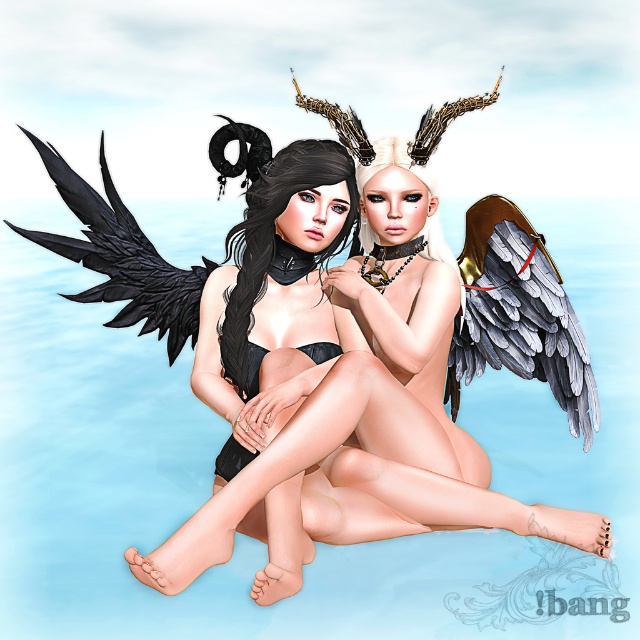
Does point (390, 436) come farther from viewer compared to point (516, 285)?

No, it is not.

At what (x,y) coordinates should I click in order to perform the action: click on black matte wings at upper left. Please return your answer as a coordinate pair (x, y). The width and height of the screenshot is (640, 640). Looking at the image, I should click on (369, 420).

Between point (371, 308) and point (532, 234), which one is positioned in front?

Positioned in front is point (371, 308).

Locate an element on the screen. The image size is (640, 640). black matte wings at upper left is located at coordinates pyautogui.click(x=369, y=420).

Does shiny metallic wing at right have a smaller size compared to black matte wing at left?

Yes, shiny metallic wing at right is smaller than black matte wing at left.

Does point (490, 333) come in front of point (64, 186)?

That is False.

Locate an element on the screen. This screenshot has width=640, height=640. shiny metallic wing at right is located at coordinates (518, 314).

How much distance is there between black matte wings at upper left and black matte wing at left?

The distance of black matte wings at upper left from black matte wing at left is 26.90 inches.

Which of these two, black matte wings at upper left or black matte wing at left, stands shorter?

black matte wing at left

Which is behind, point (355, 470) or point (161, 330)?

Point (161, 330)

The width and height of the screenshot is (640, 640). In order to click on black matte wings at upper left in this screenshot , I will do `click(369, 420)`.